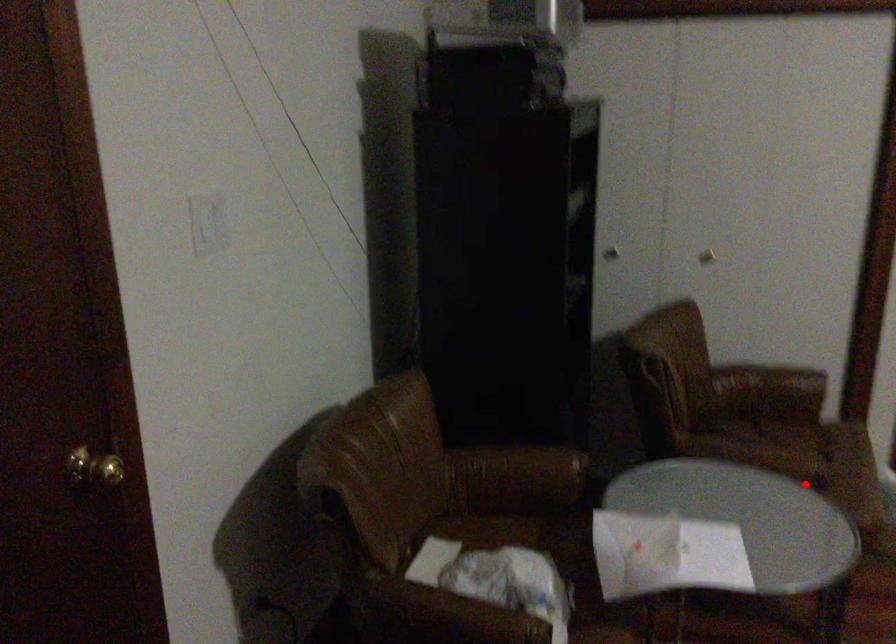
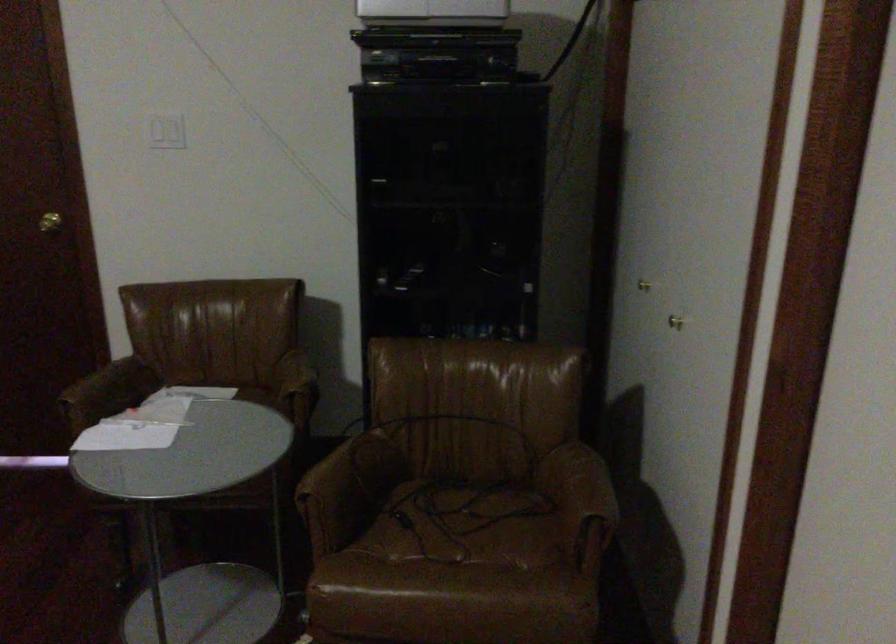
Where in the second image is the point corresponding to the highlighted location from the first image?

(312, 513)